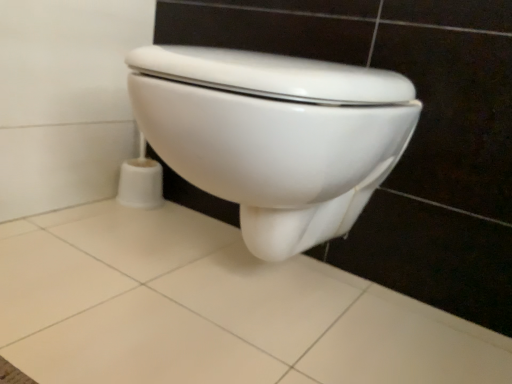
Question: In terms of height, does white glossy toilet at center look taller or shorter compared to white ceramic tile at lower center?

Choices:
 (A) tall
 (B) short

Answer: (A)

Question: In terms of width, does white glossy toilet at center look wider or thinner when compared to white ceramic tile at lower center?

Choices:
 (A) thin
 (B) wide

Answer: (A)

Question: From the image's perspective, is white glossy toilet at center located above or below white ceramic tile at lower center?

Choices:
 (A) below
 (B) above

Answer: (B)

Question: From the image's perspective, is white ceramic tile at lower center positioned above or below white glossy toilet at center?

Choices:
 (A) above
 (B) below

Answer: (B)

Question: Is white ceramic tile at lower center inside the boundaries of white glossy toilet at center, or outside?

Choices:
 (A) inside
 (B) outside

Answer: (B)

Question: Is point (354, 281) positioned closer to the camera than point (192, 57)?

Choices:
 (A) farther
 (B) closer

Answer: (A)

Question: Considering their positions, is white ceramic tile at lower center located in front of or behind white glossy toilet at center?

Choices:
 (A) behind
 (B) front

Answer: (B)